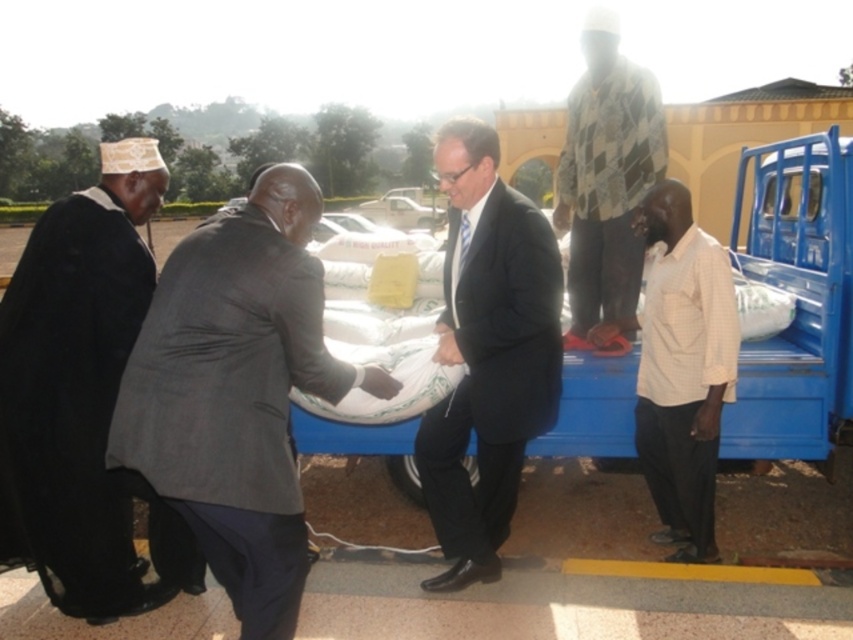
You are organizing a photo shoot and need to ensure that the white checkered shirt at right and the checkered fabric shirt at upper center are visible in the frame. Given their sizes, which shirt should you focus on to ensure both fit comfortably in the photo?

The white checkered shirt at right is smaller in width than the checkered fabric shirt at upper center. To ensure both fit comfortably, focus on framing around the larger checkered fabric shirt at upper center, allowing space for the smaller one as well.

You are a photographer trying to capture a group photo of the matte black suit at center and the white checkered shirt at right. If you want to ensure both subjects are fully visible in the frame, which subject should you position closer to the camera to avoid cropping?

The matte black suit at center has a larger width than the white checkered shirt at right. To ensure both are fully visible, position the matte black suit at center closer to the camera so its larger size can be accommodated without cropping.

You are a photographer positioned to capture the ceremony. You need to ensure both the matte black suit at center and the checkered fabric shirt at upper center are clearly visible in the frame. Given their height difference, which person might require a lower angle to be fully captured?

The matte black suit at center is much taller than the checkered fabric shirt at upper center, so a lower angle would be needed to fully capture the taller matte black suit at center while still including the shorter checkered fabric shirt at upper center in the frame.